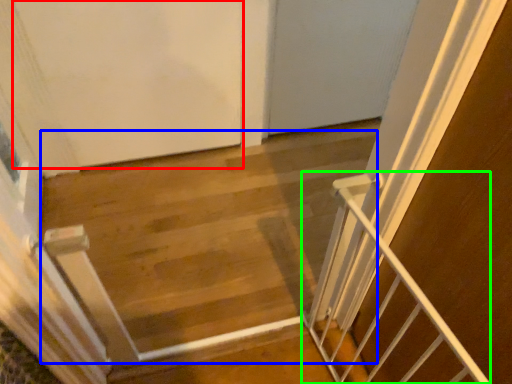
Question: Considering the real-world distances, which object is farthest from door (highlighted by a red box)? stairwell (highlighted by a blue box) or stairs (highlighted by a green box)?

Choices:
 (A) stairwell
 (B) stairs

Answer: (B)